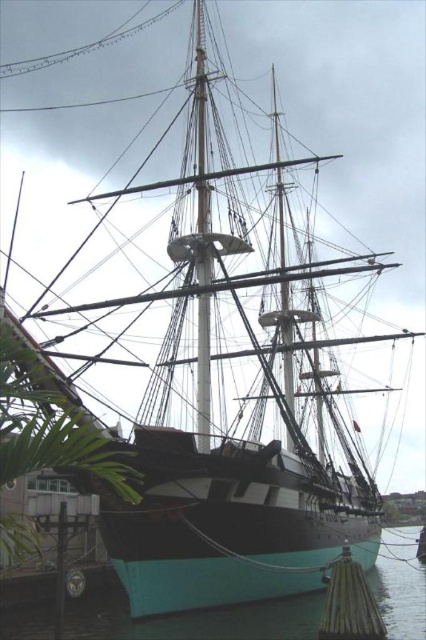
You are standing on the dock and want to step onto the ship. The ship is moored to the dock with ropes. Where is the teal glossy water at lower center in relation to your position?

The teal glossy water at lower center is located at point (x=195, y=620), which is near the lower center of the image, so it is likely between you and the ship. This means the water is where you would step into to reach the ship.

You are a sailor who needs to secure the ship using a rope that is 15 meters long. You are standing at the ship and see the teal glossy water at lower center and the green bamboo dock at lower right. Can you reach the dock with the rope?

The teal glossy water at lower center and green bamboo dock at lower right are 14.80 meters apart from each other. Since the rope is 15 meters long, which is longer than the distance between them, the sailor can reach the dock with the rope.

You are standing at the dock looking at the ship. There are two points marked on the ship. The first point is at coordinates point (74, 602) and the second point is at point (374, 609). Which point is closer to you?

Point (74, 602) is behind point (374, 609), so the point closer to you is point (374, 609).